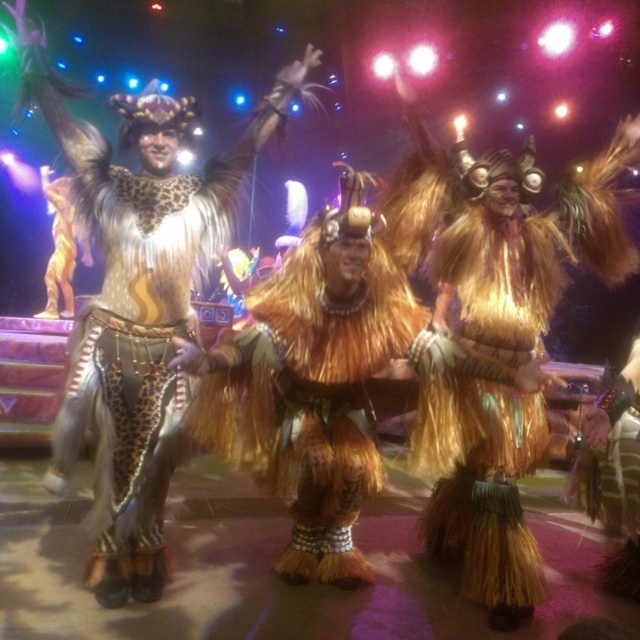
Image resolution: width=640 pixels, height=640 pixels. In order to click on leather fur coat at center in this screenshot , I will do `click(138, 305)`.

Between leather fur coat at center and fuzzy brown fur at center, which one appears on the right side from the viewer's perspective?

fuzzy brown fur at center is more to the right.

Is point (237, 182) less distant than point (312, 308)?

No, (237, 182) is further to viewer.

Locate an element on the screen. leather fur coat at center is located at coordinates (138, 305).

Can you confirm if fuzzy brown fur at center is thinner than fuzzy golden skirt at center?

No.

Is fuzzy brown fur at center to the right of fuzzy golden skirt at center from the viewer's perspective?

In fact, fuzzy brown fur at center is to the left of fuzzy golden skirt at center.

Find the location of `fuzzy brown fur at center`. fuzzy brown fur at center is located at coordinates (310, 388).

Locate an element on the screen. fuzzy brown fur at center is located at coordinates (310, 388).

In the scene shown: Can you confirm if leather fur coat at center is positioned to the right of fuzzy golden skirt at center?

Incorrect, leather fur coat at center is not on the right side of fuzzy golden skirt at center.

Does leather fur coat at center appear over fuzzy golden skirt at center?

Correct, leather fur coat at center is located above fuzzy golden skirt at center.

The width and height of the screenshot is (640, 640). Describe the element at coordinates (138, 305) in the screenshot. I see `leather fur coat at center` at that location.

Find the location of a particular element. Image resolution: width=640 pixels, height=640 pixels. leather fur coat at center is located at coordinates (138, 305).